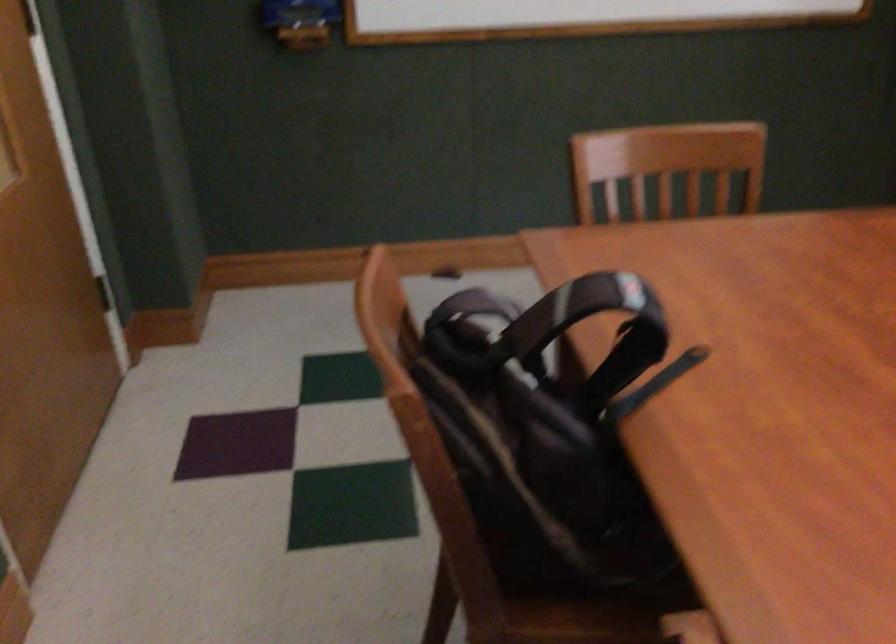
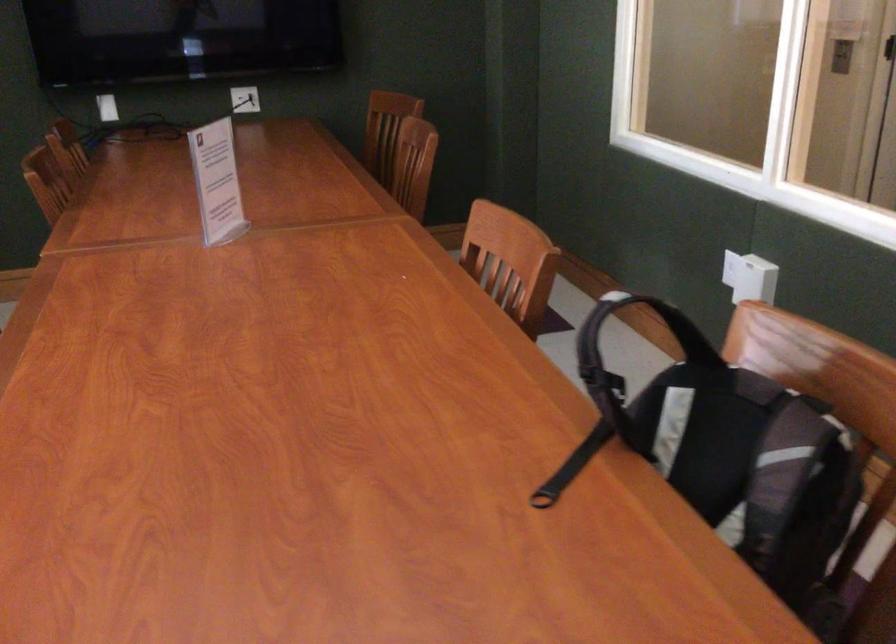
The point at (x=524, y=326) is marked in the first image. Where is the corresponding point in the second image?

(690, 337)